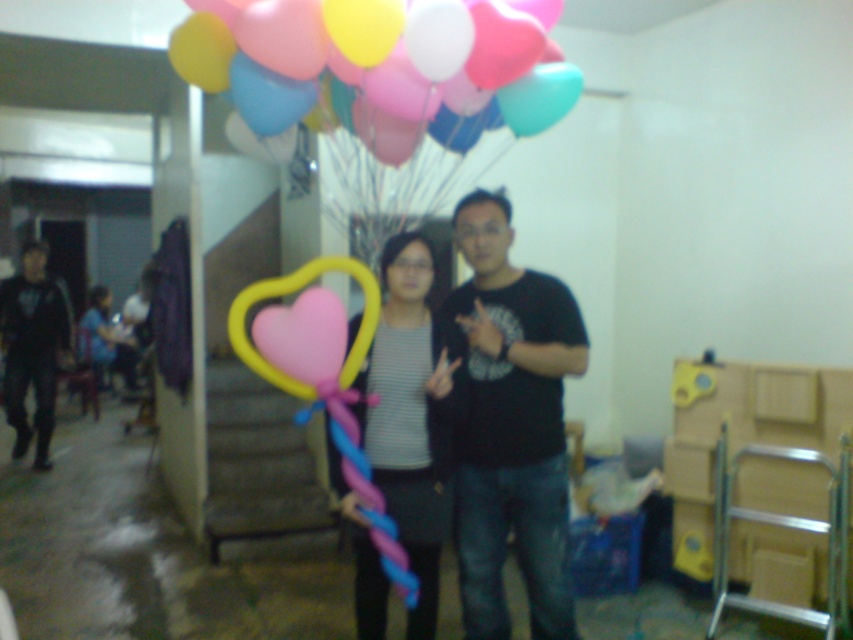
Can you confirm if black matte t-shirt at center is positioned to the right of striped fabric shirt at center?

Indeed, black matte t-shirt at center is positioned on the right side of striped fabric shirt at center.

Where is `black matte t-shirt at center`? black matte t-shirt at center is located at coordinates (509, 426).

Locate an element on the screen. This screenshot has height=640, width=853. black matte t-shirt at center is located at coordinates (509, 426).

Between black matte t-shirt at center and black matte pants at left, which one appears on the right side from the viewer's perspective?

black matte t-shirt at center

Is black matte t-shirt at center positioned before black matte pants at left?

Yes, it is.

Is point (473, 477) positioned behind point (0, 333)?

No, it is not.

The width and height of the screenshot is (853, 640). What are the coordinates of `black matte t-shirt at center` in the screenshot? It's located at (509, 426).

Does point (573, 355) come closer to viewer compared to point (271, 97)?

No, (573, 355) is further to viewer.

What do you see at coordinates (509, 426) in the screenshot? I see `black matte t-shirt at center` at bounding box center [509, 426].

The height and width of the screenshot is (640, 853). Identify the location of black matte t-shirt at center. (509, 426).